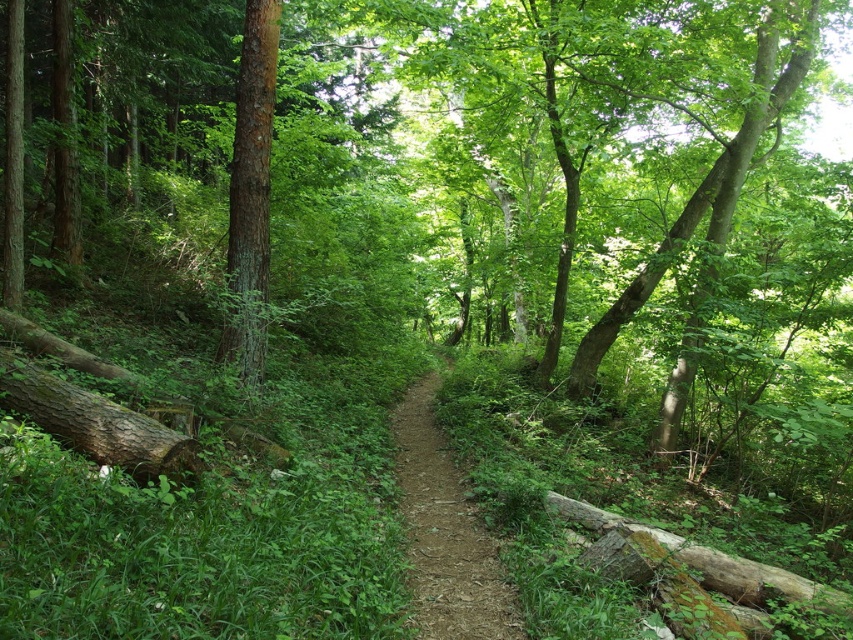
Question: Among these objects, which one is nearest to the camera?

Choices:
 (A) dirt path at center
 (B) smooth brown tree trunk at center-left

Answer: (A)

Question: Does dirt path at center appear on the right side of smooth brown tree trunk at center-left?

Choices:
 (A) no
 (B) yes

Answer: (B)

Question: Is dirt path at center wider than smooth brown tree trunk at center-left?

Choices:
 (A) yes
 (B) no

Answer: (A)

Question: Is dirt path at center bigger than smooth brown tree trunk at center-left?

Choices:
 (A) yes
 (B) no

Answer: (A)